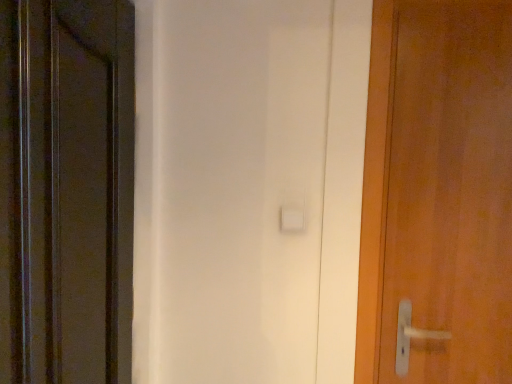
Question: From their relative heights in the image, would you say wooden door at right, which is the second door from left to right, is taller or shorter than matte black door at left, arranged as the 2th door when viewed from the right?

Choices:
 (A) tall
 (B) short

Answer: (B)

Question: In terms of size, does wooden door at right, which is the second door from left to right, appear bigger or smaller than matte black door at left, placed as the first door when sorted from left to right?

Choices:
 (A) big
 (B) small

Answer: (B)

Question: From the image's perspective, is wooden door at right, which is the second door from left to right, positioned above or below matte black door at left, placed as the first door when sorted from left to right?

Choices:
 (A) above
 (B) below

Answer: (A)

Question: Is matte black door at left, arranged as the 2th door when viewed from the right, to the left or to the right of wooden door at right, which appears as the 1th door when viewed from the right, in the image?

Choices:
 (A) right
 (B) left

Answer: (B)

Question: Is point (40, 372) closer or farther from the camera than point (433, 190)?

Choices:
 (A) farther
 (B) closer

Answer: (B)

Question: From their relative heights in the image, would you say matte black door at left, placed as the first door when sorted from left to right, is taller or shorter than wooden door at right, which is the second door from left to right?

Choices:
 (A) tall
 (B) short

Answer: (A)

Question: From the image's perspective, is matte black door at left, placed as the first door when sorted from left to right, positioned above or below wooden door at right, which is the second door from left to right?

Choices:
 (A) above
 (B) below

Answer: (B)